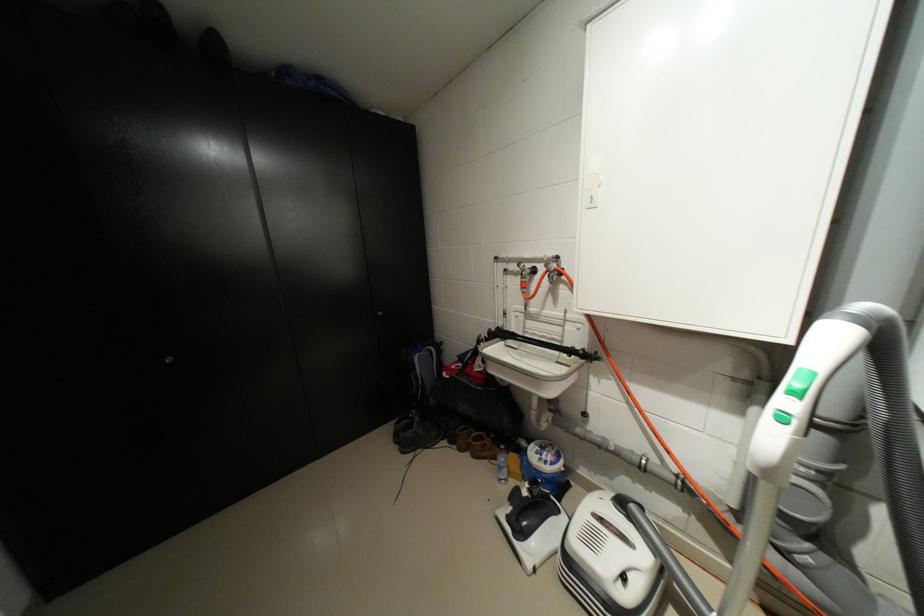
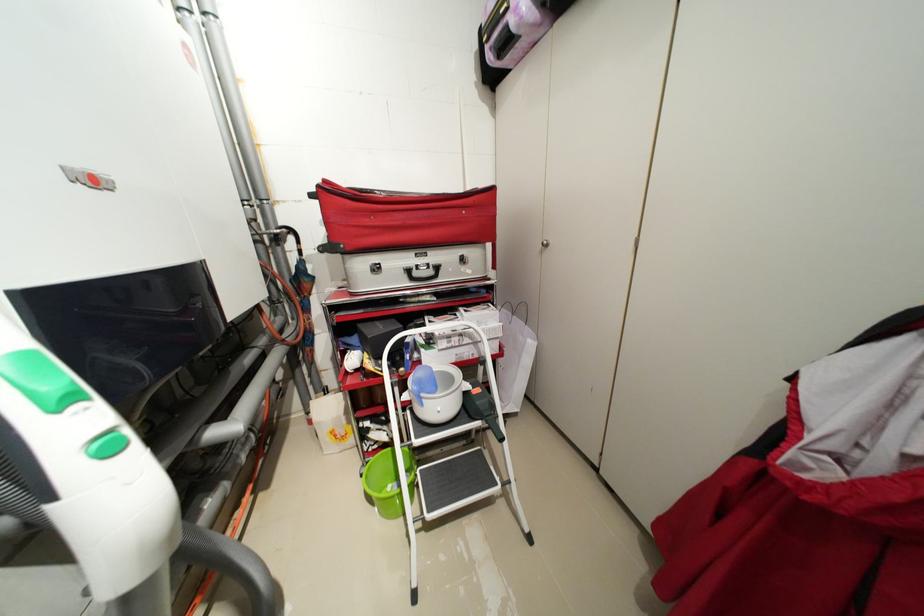
In the second image, find the point that corresponds to (789,421) in the first image.

(117, 454)